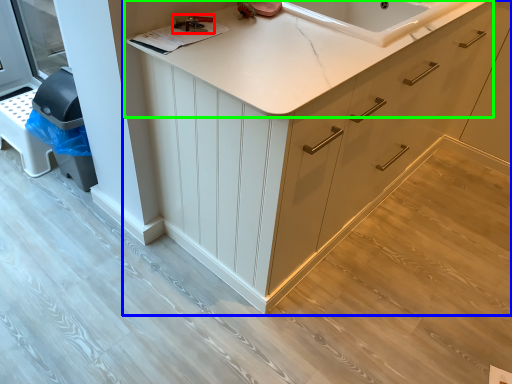
Question: Which object is positioned closest to tool (highlighted by a red box)? Select from cabinetry (highlighted by a blue box) and countertop (highlighted by a green box).

Choices:
 (A) cabinetry
 (B) countertop

Answer: (B)